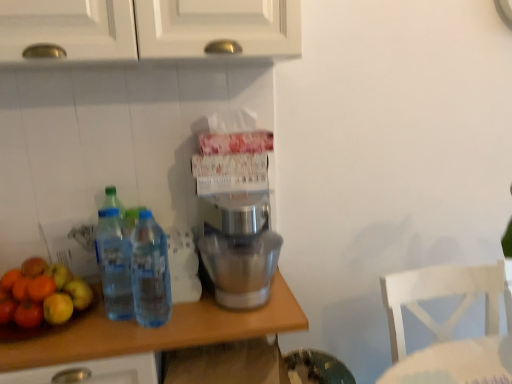
Locate an element on the screen. free spot to the right of transparent plastic bottles at left, the first bottle viewed from the left is located at coordinates (195, 321).